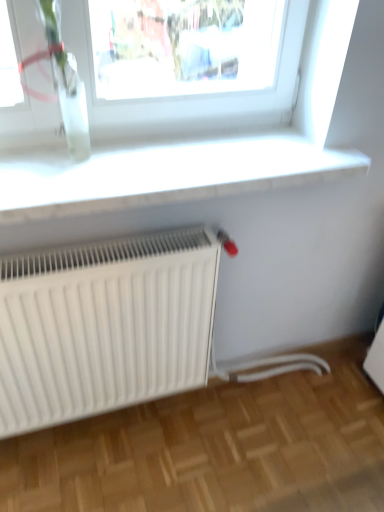
Where is `vacant area in front of clear glass vase at upper left`? The height and width of the screenshot is (512, 384). vacant area in front of clear glass vase at upper left is located at coordinates (51, 179).